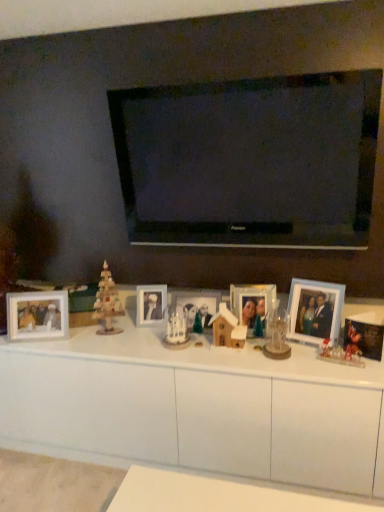
Question: Does wooden photo frame at left, marked as the sixth picture frame in a right-to-left arrangement, appear on the right side of wooden christmas tree at left?

Choices:
 (A) yes
 (B) no

Answer: (B)

Question: Is wooden photo frame at left, marked as the sixth picture frame in a right-to-left arrangement, turned away from wooden christmas tree at left?

Choices:
 (A) no
 (B) yes

Answer: (A)

Question: Considering the relative sizes of wooden photo frame at left, placed as the first picture frame when sorted from left to right, and wooden christmas tree at left in the image provided, is wooden photo frame at left, placed as the first picture frame when sorted from left to right, shorter than wooden christmas tree at left?

Choices:
 (A) yes
 (B) no

Answer: (A)

Question: Does wooden photo frame at left, marked as the sixth picture frame in a right-to-left arrangement, touch wooden christmas tree at left?

Choices:
 (A) yes
 (B) no

Answer: (B)

Question: Considering the relative sizes of wooden photo frame at left, marked as the sixth picture frame in a right-to-left arrangement, and wooden christmas tree at left in the image provided, is wooden photo frame at left, marked as the sixth picture frame in a right-to-left arrangement, thinner than wooden christmas tree at left?

Choices:
 (A) yes
 (B) no

Answer: (A)

Question: Does wooden photo frame at left, marked as the sixth picture frame in a right-to-left arrangement, have a greater height compared to wooden christmas tree at left?

Choices:
 (A) no
 (B) yes

Answer: (A)

Question: Is matte white photo frame at center, the 5th picture frame viewed from the right, completely or partially inside wooden house at center, the first toy in the left-to-right sequence?

Choices:
 (A) yes
 (B) no

Answer: (B)

Question: Does wooden house at center, placed as the 2th toy when sorted from right to left, appear on the left side of matte white photo frame at center, acting as the 2th picture frame starting from the left?

Choices:
 (A) yes
 (B) no

Answer: (B)

Question: Is wooden house at center, the first toy in the left-to-right sequence, bigger than matte white photo frame at center, the 5th picture frame viewed from the right?

Choices:
 (A) no
 (B) yes

Answer: (B)

Question: From a real-world perspective, does wooden house at center, positioned as the 1th toy in back-to-front order, sit lower than matte white photo frame at center, acting as the 2th picture frame starting from the left?

Choices:
 (A) no
 (B) yes

Answer: (A)

Question: Is wooden house at center, acting as the second toy starting from the front, not near matte white photo frame at center, acting as the 2th picture frame starting from the left?

Choices:
 (A) yes
 (B) no

Answer: (B)

Question: Is wooden house at center, placed as the 2th toy when sorted from right to left, further to camera compared to matte white photo frame at center, the 5th picture frame viewed from the right?

Choices:
 (A) yes
 (B) no

Answer: (B)

Question: Is white glossy cabinet at center oriented away from wooden christmas tree at left?

Choices:
 (A) yes
 (B) no

Answer: (B)